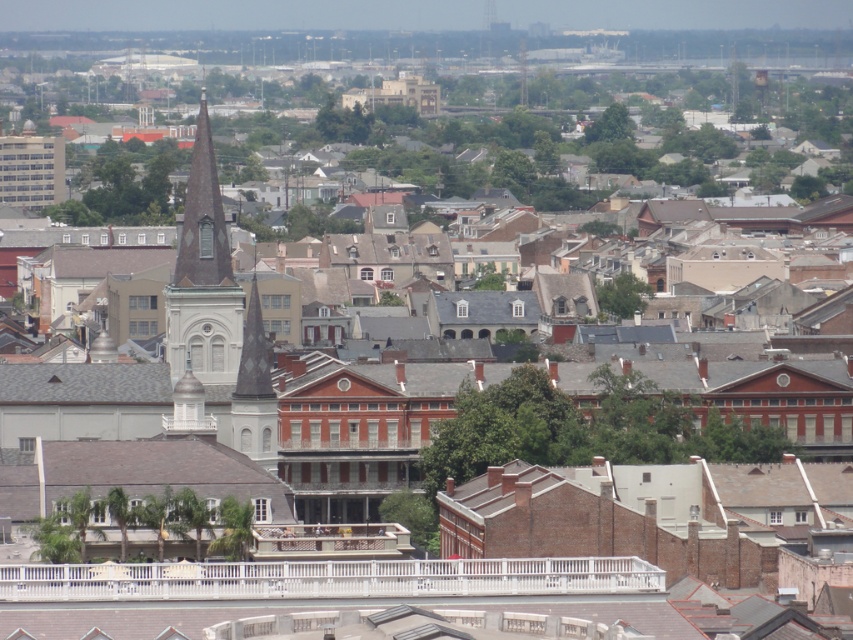
Question: Is the position of smooth gray steeple at center less distant than that of white stone spire at center-left?

Choices:
 (A) yes
 (B) no

Answer: (B)

Question: Is smooth gray steeple at center thinner than white stone spire at center-left?

Choices:
 (A) yes
 (B) no

Answer: (B)

Question: Does smooth gray steeple at center appear over white stone spire at center-left?

Choices:
 (A) no
 (B) yes

Answer: (B)